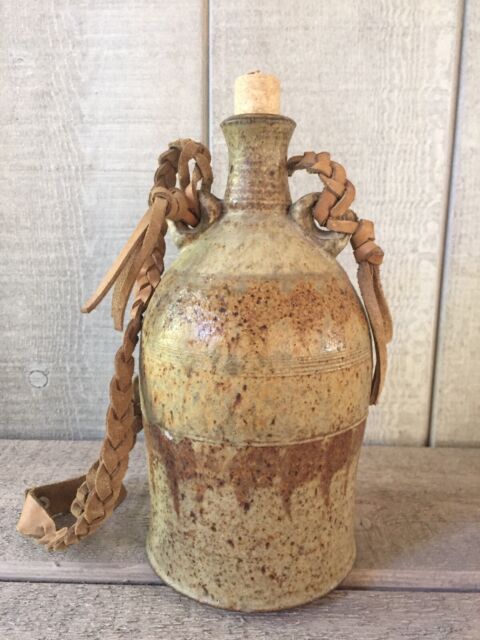
Find the location of a particular element. The image size is (480, 640). wall is located at coordinates (401, 380).